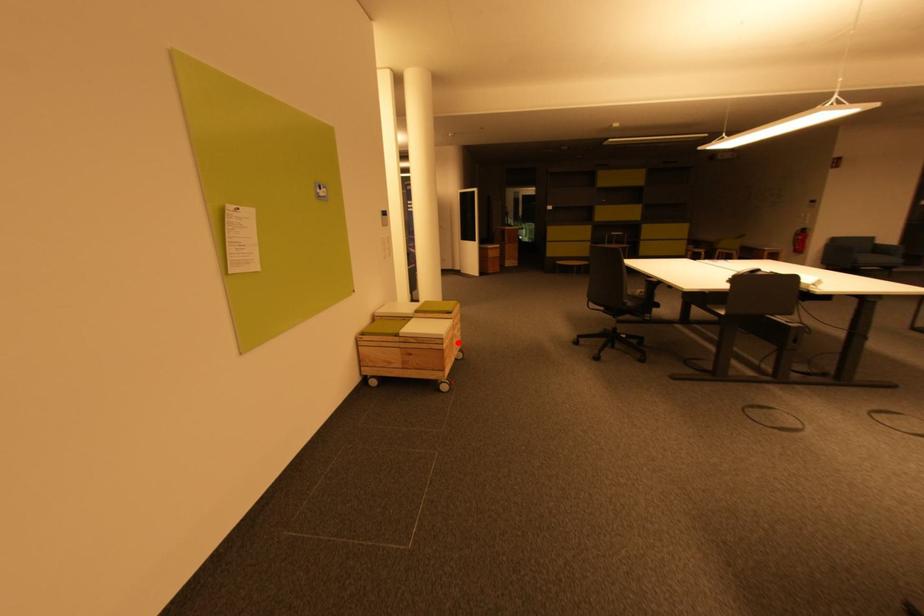
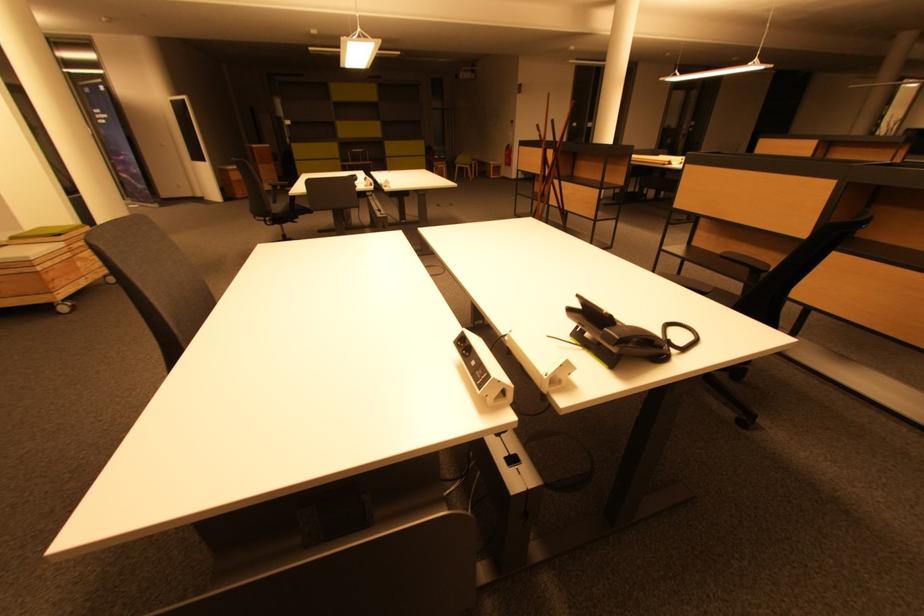
In the second image, find the point that corresponds to the highlighted location in the first image.

(83, 265)